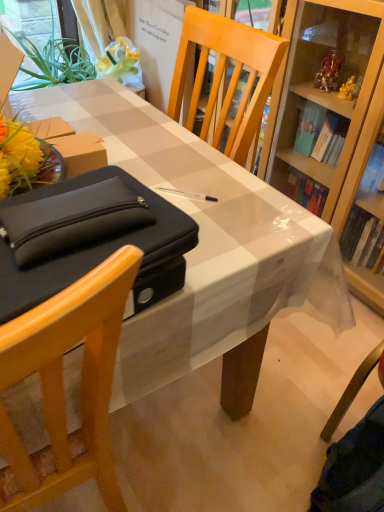
Question: Does white glossy desk at center have a greater height compared to matte black bag at left?

Choices:
 (A) yes
 (B) no

Answer: (A)

Question: Can you confirm if white glossy desk at center is thinner than matte black bag at left?

Choices:
 (A) no
 (B) yes

Answer: (B)

Question: Does white glossy desk at center touch matte black bag at left?

Choices:
 (A) no
 (B) yes

Answer: (A)

Question: Considering the relative sizes of white glossy desk at center and matte black bag at left in the image provided, is white glossy desk at center bigger than matte black bag at left?

Choices:
 (A) no
 (B) yes

Answer: (B)

Question: Is white glossy desk at center behind matte black bag at left?

Choices:
 (A) yes
 (B) no

Answer: (A)

Question: From a real-world perspective, is white glossy desk at center beneath matte black bag at left?

Choices:
 (A) yes
 (B) no

Answer: (B)

Question: Is matte black bag at left facing towards black fabric pouch at left?

Choices:
 (A) no
 (B) yes

Answer: (A)

Question: Can black fabric pouch at left be found inside matte black bag at left?

Choices:
 (A) yes
 (B) no

Answer: (A)

Question: Is matte black bag at left facing away from black fabric pouch at left?

Choices:
 (A) yes
 (B) no

Answer: (B)

Question: Does matte black bag at left appear on the right side of black fabric pouch at left?

Choices:
 (A) no
 (B) yes

Answer: (A)

Question: Is matte black bag at left positioned beyond the bounds of black fabric pouch at left?

Choices:
 (A) yes
 (B) no

Answer: (A)

Question: Can you confirm if matte black bag at left is shorter than black fabric pouch at left?

Choices:
 (A) no
 (B) yes

Answer: (A)

Question: Considering the relative sizes of black fabric pouch at left and matte black bag at left in the image provided, is black fabric pouch at left wider than matte black bag at left?

Choices:
 (A) no
 (B) yes

Answer: (A)